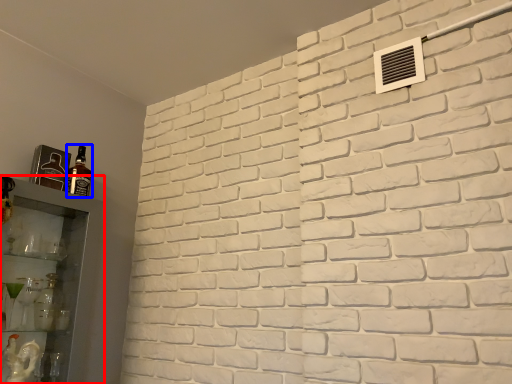
Question: Which object is closer to the camera taking this photo, shelf (highlighted by a red box) or bottle (highlighted by a blue box)?

Choices:
 (A) shelf
 (B) bottle

Answer: (A)